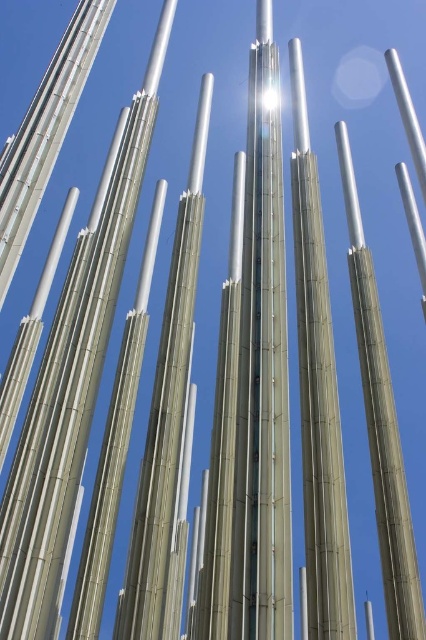
What do you see at coordinates (252, 387) in the screenshot? This screenshot has height=640, width=426. I see `shiny metallic tower at center` at bounding box center [252, 387].

Does shiny metallic tower at center appear under satin silver pole at center?

Actually, shiny metallic tower at center is above satin silver pole at center.

Is point (235, 257) positioned after point (100, 458)?

That is True.

Where is `shiny metallic tower at center`? The image size is (426, 640). shiny metallic tower at center is located at coordinates (252, 387).

Which is below, metallic bamboo tower at center or silver bamboo pole at center?

silver bamboo pole at center is lower down.

How distant is metallic bamboo tower at center from silver bamboo pole at center?

They are 7.69 meters apart.

The width and height of the screenshot is (426, 640). Find the location of `metallic bamboo tower at center`. metallic bamboo tower at center is located at coordinates (71, 380).

What are the coordinates of `metallic bamboo tower at center` in the screenshot? It's located at (71, 380).

What do you see at coordinates (71, 380) in the screenshot?
I see `metallic bamboo tower at center` at bounding box center [71, 380].

Which of these two, metallic bamboo tower at center or brushed metal pole at center, stands shorter?

metallic bamboo tower at center is shorter.

Locate an element on the screen. Image resolution: width=426 pixels, height=640 pixels. metallic bamboo tower at center is located at coordinates (71, 380).